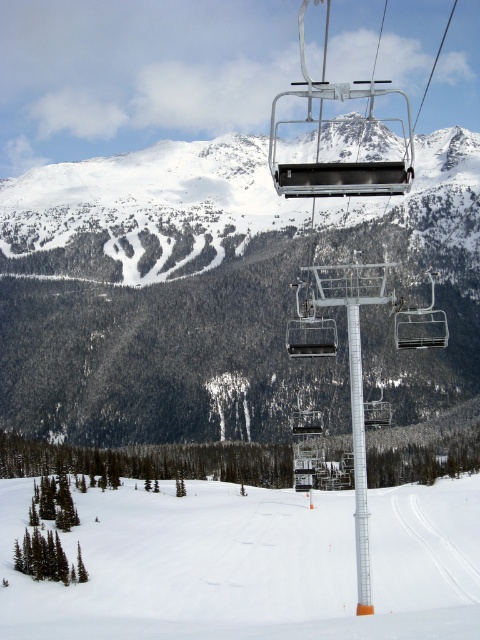
Is white snow ski slope at lower left to the left of metallic silver chair at center from the viewer's perspective?

Indeed, white snow ski slope at lower left is positioned on the left side of metallic silver chair at center.

Is white snow ski slope at lower left shorter than metallic silver chair at center?

In fact, white snow ski slope at lower left may be taller than metallic silver chair at center.

Which is in front, point (384, 637) or point (406, 321)?

Point (384, 637) is more forward.

Where is `white snow ski slope at lower left`? Image resolution: width=480 pixels, height=640 pixels. white snow ski slope at lower left is located at coordinates (251, 564).

Can you confirm if snowy forested mountain at center is thinner than white snow ski slope at lower left?

Incorrect, snowy forested mountain at center's width is not less than white snow ski slope at lower left's.

Does snowy forested mountain at center come in front of white snow ski slope at lower left?

No, it is behind white snow ski slope at lower left.

Is point (29, 253) farther from viewer compared to point (254, 532)?

Yes, it is behind point (254, 532).

This screenshot has width=480, height=640. Find the location of `snowy forested mountain at center`. snowy forested mountain at center is located at coordinates (156, 300).

Is snowy forested mountain at center bigger than white plastic pole at center?

Indeed, snowy forested mountain at center has a larger size compared to white plastic pole at center.

Who is higher up, snowy forested mountain at center or white plastic pole at center?

snowy forested mountain at center is above.

What do you see at coordinates (156, 300) in the screenshot? Image resolution: width=480 pixels, height=640 pixels. I see `snowy forested mountain at center` at bounding box center [156, 300].

The height and width of the screenshot is (640, 480). Identify the location of snowy forested mountain at center. (156, 300).